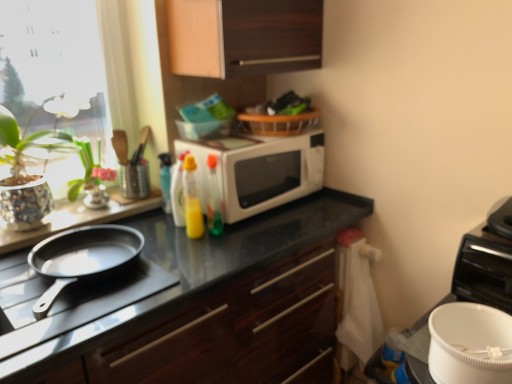
You are a GUI agent. You are given a task and a screenshot of the screen. Output one action in this format:
    pyautogui.click(x=<x>, y=<y>)
    Task: Click on the empty space that is ontop of glossy dark wood cabinet at center, the 1th cabinetry from the bottom (from a real-world perspective)
    
    Given the screenshot: What is the action you would take?
    pyautogui.click(x=186, y=247)